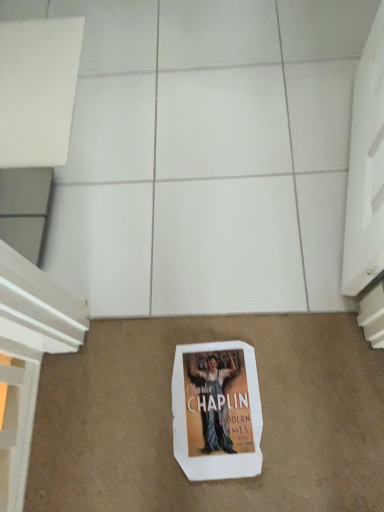
Measure the distance between matte paper poster at center and camera.

They are 37.07 inches apart.

Describe the element at coordinates (216, 411) in the screenshot. The image size is (384, 512). I see `matte paper poster at center` at that location.

You are a GUI agent. You are given a task and a screenshot of the screen. Output one action in this format:
    pyautogui.click(x=<x>, y=<y>)
    Task: Click on the matte paper poster at center
    The height and width of the screenshot is (512, 384).
    Given the screenshot: What is the action you would take?
    pyautogui.click(x=216, y=411)

Where is `matte paper poster at center`? This screenshot has width=384, height=512. matte paper poster at center is located at coordinates (216, 411).